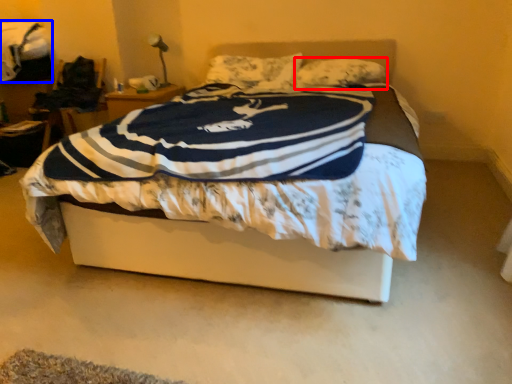
Question: Which object appears closest to the camera in this image, pillow (highlighted by a red box) or blanket (highlighted by a blue box)?

Choices:
 (A) pillow
 (B) blanket

Answer: (A)